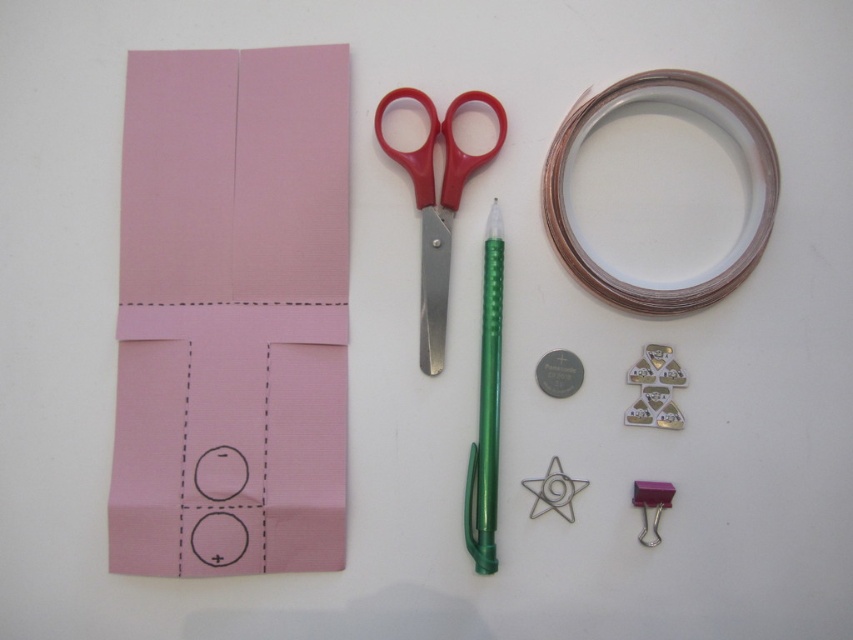
Question: Is the position of pink paper at left more distant than that of green metallic pen at center?

Choices:
 (A) no
 (B) yes

Answer: (A)

Question: Can you confirm if red plastic scissors at center is wider than green metallic pen at center?

Choices:
 (A) yes
 (B) no

Answer: (A)

Question: Which object appears farthest from the camera in this image?

Choices:
 (A) red plastic scissors at center
 (B) transparent plastic ring at upper center
 (C) green metallic pen at center
 (D) pink plastic binder clip at lower right

Answer: (A)

Question: Which point appears farthest from the camera in this image?

Choices:
 (A) (657, 506)
 (B) (474, 548)
 (C) (421, 237)
 (D) (723, 93)

Answer: (C)

Question: Which point is closer to the camera?

Choices:
 (A) green metallic pen at center
 (B) red plastic scissors at center
 (C) transparent plastic ring at upper center

Answer: (C)

Question: Is pink paper at left thinner than pink plastic binder clip at lower right?

Choices:
 (A) yes
 (B) no

Answer: (B)